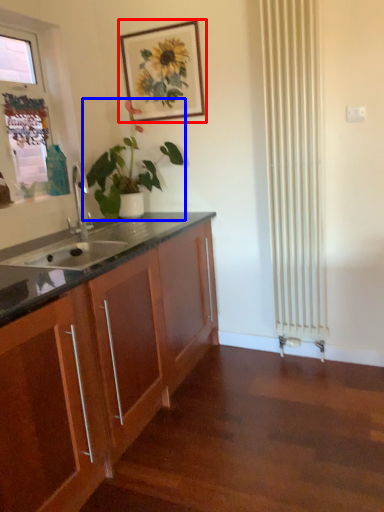
Question: Which object is further to the camera taking this photo, picture frame (highlighted by a red box) or houseplant (highlighted by a blue box)?

Choices:
 (A) picture frame
 (B) houseplant

Answer: (A)